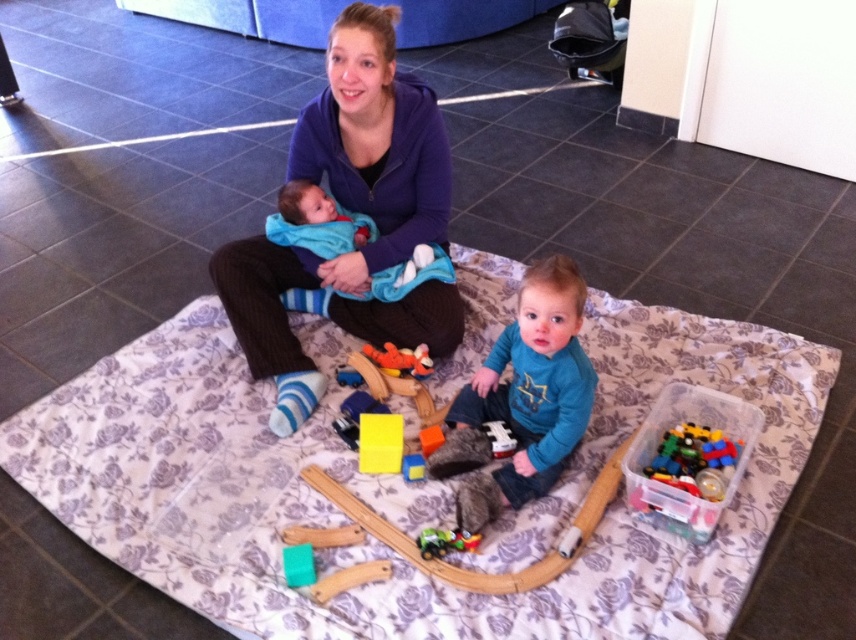
Who is positioned more to the left, wooden block at center or matte orange toy at center?

wooden block at center

Which is in front, point (428, 408) or point (391, 368)?

Positioned in front is point (428, 408).

Image resolution: width=856 pixels, height=640 pixels. Find the location of `wooden block at center`. wooden block at center is located at coordinates (397, 388).

Can you confirm if purple fleece jacket at upper center is positioned below green plastic toy car at center?

No.

Who is positioned more to the right, purple fleece jacket at upper center or green plastic toy car at center?

green plastic toy car at center is more to the right.

Is point (428, 204) in front of point (473, 545)?

That is False.

Image resolution: width=856 pixels, height=640 pixels. Find the location of `purple fleece jacket at upper center`. purple fleece jacket at upper center is located at coordinates [x=351, y=211].

Is floral fabric blanket at center below green plastic toy car at center?

Actually, floral fabric blanket at center is above green plastic toy car at center.

Who is positioned more to the left, floral fabric blanket at center or green plastic toy car at center?

floral fabric blanket at center

This screenshot has height=640, width=856. What do you see at coordinates (405, 484) in the screenshot? I see `floral fabric blanket at center` at bounding box center [405, 484].

Locate an element on the screen. floral fabric blanket at center is located at coordinates (405, 484).